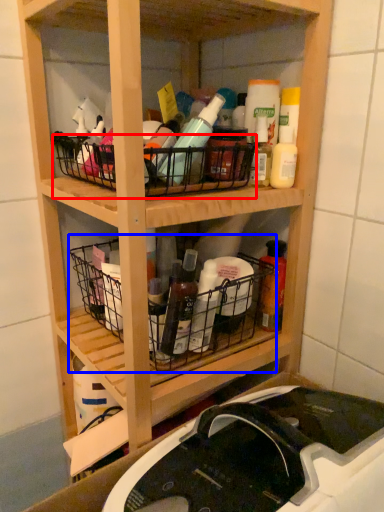
Question: Which of the following is the farthest to the observer, basket (highlighted by a red box) or basket (highlighted by a blue box)?

Choices:
 (A) basket
 (B) basket

Answer: (B)